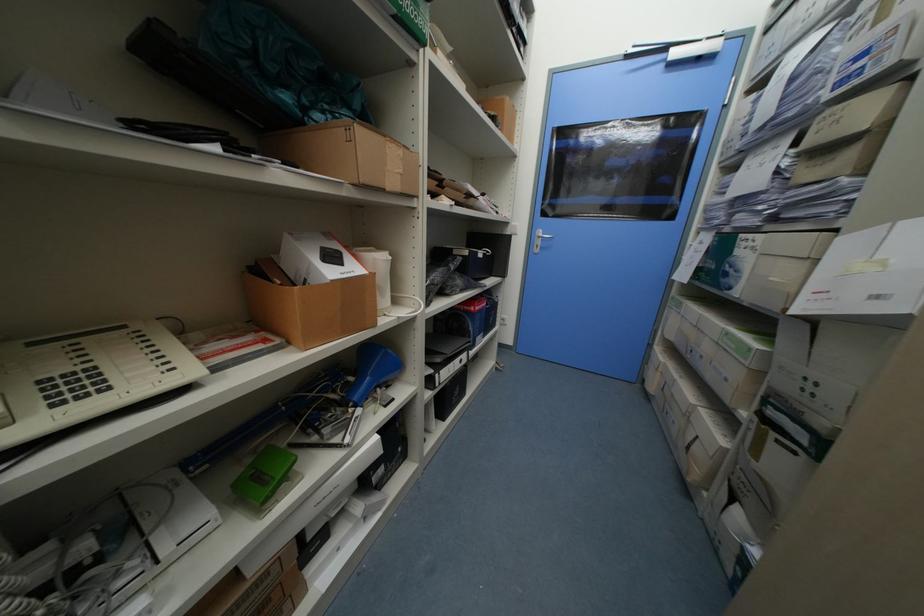
Where is `silver door handle`? This screenshot has width=924, height=616. silver door handle is located at coordinates (539, 240).